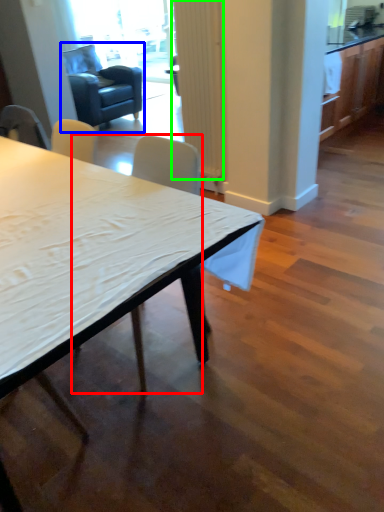
Question: Considering the real-world distances, which object is farthest from chair (highlighted by a red box)? swivel chair (highlighted by a blue box) or curtain (highlighted by a green box)?

Choices:
 (A) swivel chair
 (B) curtain

Answer: (A)